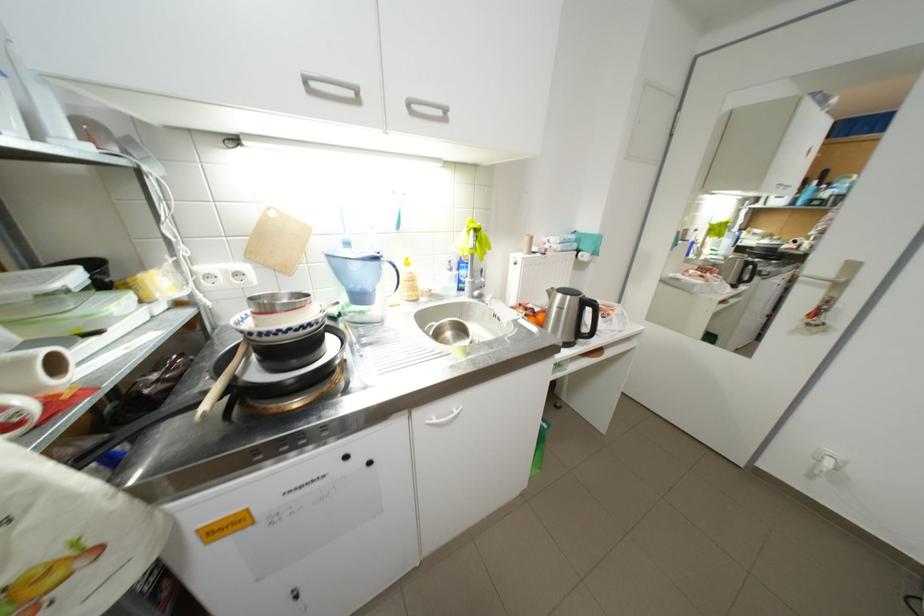
Locate an element on the screen. The image size is (924, 616). yellow pump dispenser is located at coordinates (471, 254).